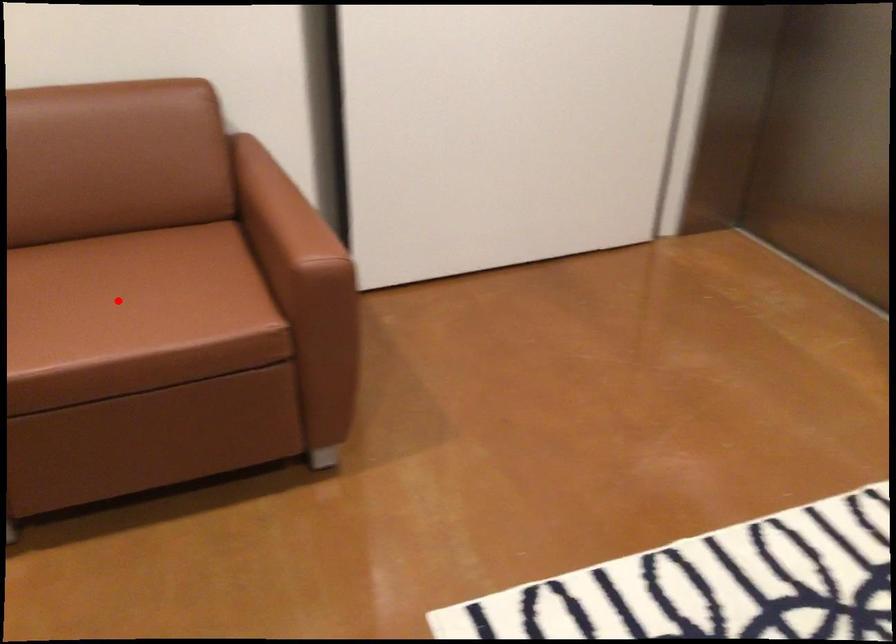
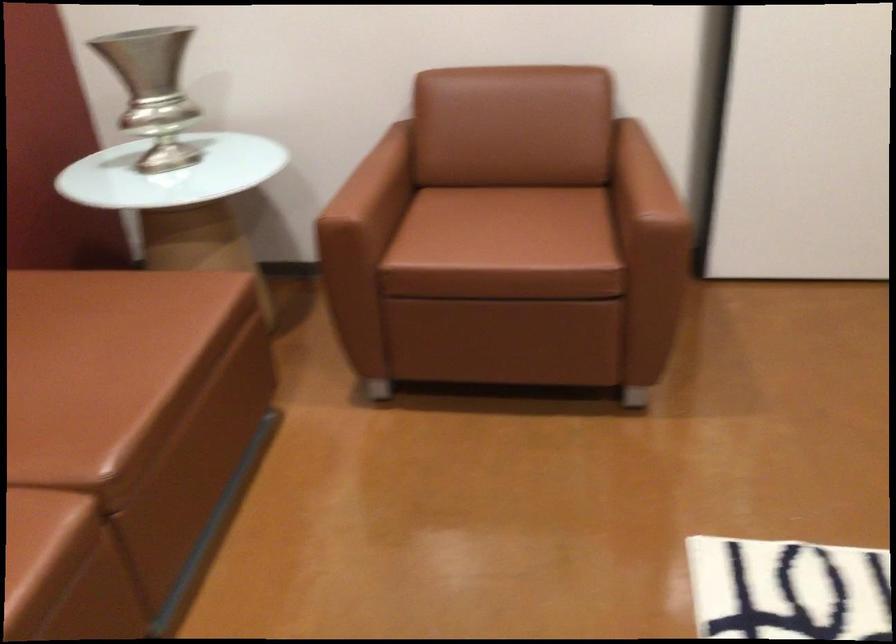
The point at the highlighted location is marked in the first image. Where is the corresponding point in the second image?

(497, 228)